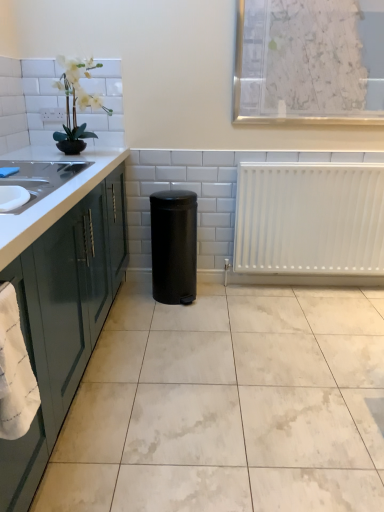
Question: Is point (112, 233) closer or farther from the camera than point (84, 129)?

Choices:
 (A) closer
 (B) farther

Answer: (A)

Question: Choose the correct answer: Is green glossy cabinetry at left inside white artificial plant at upper left or outside it?

Choices:
 (A) inside
 (B) outside

Answer: (B)

Question: Estimate the real-world distances between objects in this image. Which object is closer to the white textured paper at upper center?

Choices:
 (A) white glossy countertop at left
 (B) green glossy cabinetry at left
 (C) black matte trash can at center
 (D) white matte radiator at right
 (E) white artificial plant at upper left

Answer: (D)

Question: Estimate the real-world distances between objects in this image. Which object is closer to the black matte trash can at center?

Choices:
 (A) white artificial plant at upper left
 (B) white glossy countertop at left
 (C) white matte radiator at right
 (D) green glossy cabinetry at left
 (E) white textured paper at upper center

Answer: (C)